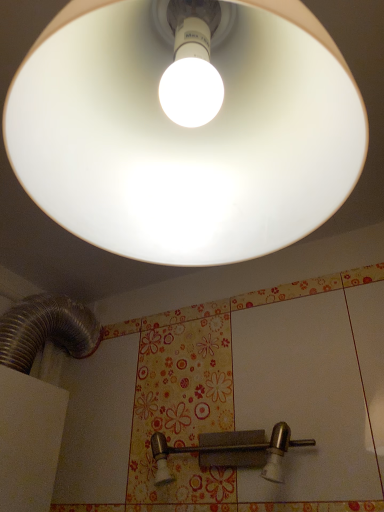
Question: Would you say satin nickel lever at lower center is outside matte white lampshade at upper center?

Choices:
 (A) yes
 (B) no

Answer: (A)

Question: Is there a large distance between satin nickel lever at lower center and matte white lampshade at upper center?

Choices:
 (A) yes
 (B) no

Answer: (B)

Question: Considering the relative sizes of satin nickel lever at lower center and matte white lampshade at upper center in the image provided, is satin nickel lever at lower center wider than matte white lampshade at upper center?

Choices:
 (A) no
 (B) yes

Answer: (A)

Question: Considering the relative sizes of satin nickel lever at lower center and matte white lampshade at upper center in the image provided, is satin nickel lever at lower center smaller than matte white lampshade at upper center?

Choices:
 (A) yes
 (B) no

Answer: (A)

Question: From the image's perspective, would you say satin nickel lever at lower center is positioned over matte white lampshade at upper center?

Choices:
 (A) no
 (B) yes

Answer: (A)

Question: Is satin nickel lever at lower center beside matte white lampshade at upper center?

Choices:
 (A) yes
 (B) no

Answer: (B)

Question: Is matte white lampshade at upper center beside satin nickel lever at lower center?

Choices:
 (A) yes
 (B) no

Answer: (B)

Question: Is matte white lampshade at upper center not near satin nickel lever at lower center?

Choices:
 (A) no
 (B) yes

Answer: (A)

Question: Considering the relative positions of matte white lampshade at upper center and satin nickel lever at lower center in the image provided, is matte white lampshade at upper center to the right of satin nickel lever at lower center from the viewer's perspective?

Choices:
 (A) no
 (B) yes

Answer: (A)

Question: Is satin nickel lever at lower center located within matte white lampshade at upper center?

Choices:
 (A) yes
 (B) no

Answer: (B)

Question: Does matte white lampshade at upper center have a larger size compared to satin nickel lever at lower center?

Choices:
 (A) no
 (B) yes

Answer: (B)

Question: Can you confirm if matte white lampshade at upper center is smaller than satin nickel lever at lower center?

Choices:
 (A) yes
 (B) no

Answer: (B)

Question: Does point (344, 183) appear closer or farther from the camera than point (200, 442)?

Choices:
 (A) closer
 (B) farther

Answer: (A)